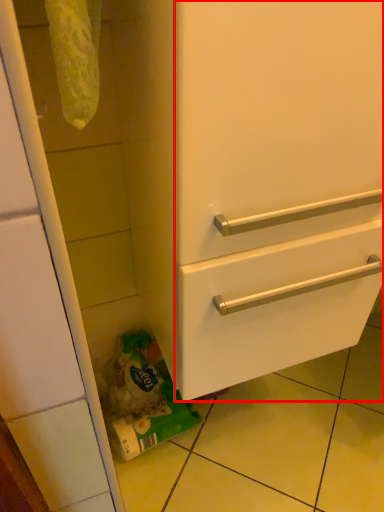
Question: From the image's perspective, what is the correct spatial positioning of door (annotated by the red box) in reference to garbage?

Choices:
 (A) below
 (B) above

Answer: (B)